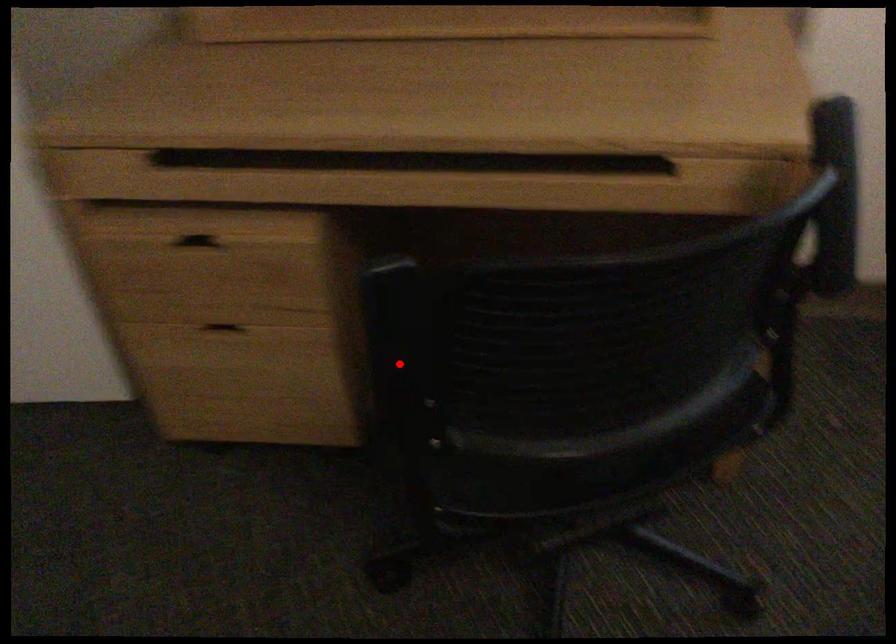
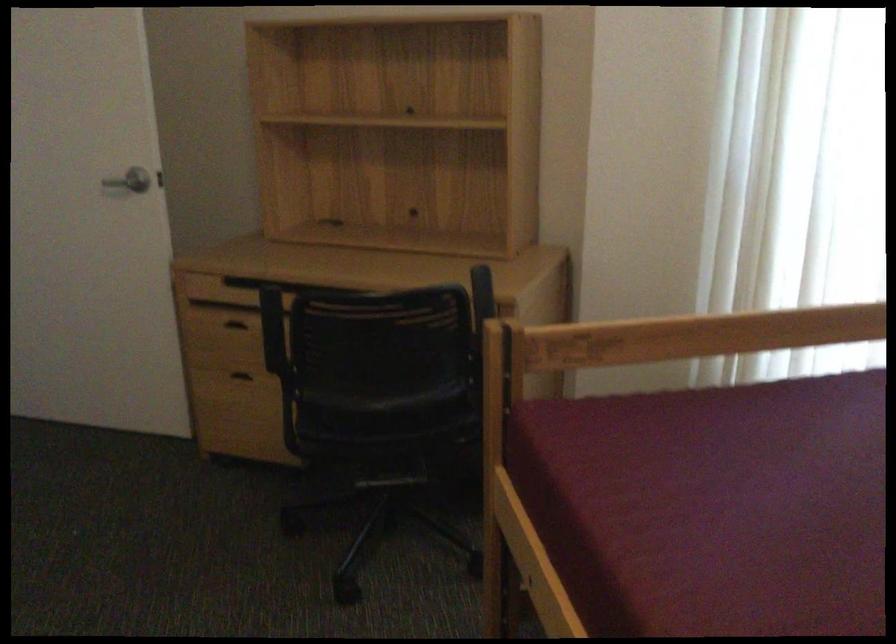
In the second image, find the point that corresponds to the highlighted location in the first image.

(273, 333)